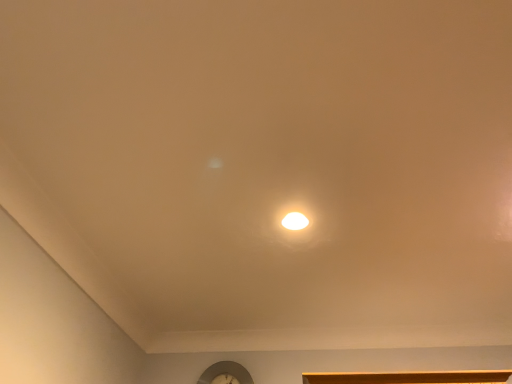
I want to click on metallic silver clock at lower center, so click(x=225, y=374).

What do you see at coordinates (225, 374) in the screenshot?
I see `metallic silver clock at lower center` at bounding box center [225, 374].

Locate an element on the screen. white glossy light fixture at center is located at coordinates tap(295, 221).

This screenshot has height=384, width=512. What do you see at coordinates (295, 221) in the screenshot? I see `white glossy light fixture at center` at bounding box center [295, 221].

The height and width of the screenshot is (384, 512). Find the location of `metallic silver clock at lower center`. metallic silver clock at lower center is located at coordinates (225, 374).

Which is more to the left, metallic silver clock at lower center or white glossy light fixture at center?

metallic silver clock at lower center.

Which object is closer to the camera taking this photo, metallic silver clock at lower center or white glossy light fixture at center?

white glossy light fixture at center is more forward.

Is point (214, 373) closer or farther from the camera than point (295, 215)?

Point (214, 373) appears to be farther away from the viewer than point (295, 215).

From the image's perspective, which is below, metallic silver clock at lower center or white glossy light fixture at center?

metallic silver clock at lower center, from the image's perspective.

From a real-world perspective, which is physically above, metallic silver clock at lower center or white glossy light fixture at center?

white glossy light fixture at center is physically above.

Which of these two, metallic silver clock at lower center or white glossy light fixture at center, is wider?

Wider between the two is white glossy light fixture at center.

Is metallic silver clock at lower center taller or shorter than white glossy light fixture at center?

metallic silver clock at lower center is taller than white glossy light fixture at center.

Can you confirm if metallic silver clock at lower center is smaller than white glossy light fixture at center?

No, metallic silver clock at lower center is not smaller than white glossy light fixture at center.

Consider the image. Would you say white glossy light fixture at center is part of metallic silver clock at lower center's contents?

No, white glossy light fixture at center is not surrounded by metallic silver clock at lower center.

Would you consider metallic silver clock at lower center to be distant from white glossy light fixture at center?

metallic silver clock at lower center is far away from white glossy light fixture at center.

Does metallic silver clock at lower center turn towards white glossy light fixture at center?

Yes.

Image resolution: width=512 pixels, height=384 pixels. Find the location of `clock on the left of white glossy light fixture at center`. clock on the left of white glossy light fixture at center is located at coordinates (225, 374).

Is white glossy light fixture at center to the left or to the right of metallic silver clock at lower center in the image?

white glossy light fixture at center is to the right of metallic silver clock at lower center.

Which object is closer to the camera taking this photo, white glossy light fixture at center or metallic silver clock at lower center?

white glossy light fixture at center is more forward.

Is point (296, 221) farther from viewer compared to point (210, 373)?

That is False.

From the image's perspective, is white glossy light fixture at center above metallic silver clock at lower center?

Indeed, from the image's perspective, white glossy light fixture at center is shown above metallic silver clock at lower center.

From a real-world perspective, is white glossy light fixture at center positioned under metallic silver clock at lower center based on gravity?

Incorrect, from a real-world perspective, white glossy light fixture at center is higher than metallic silver clock at lower center.

Which object is wider, white glossy light fixture at center or metallic silver clock at lower center?

With larger width is white glossy light fixture at center.

Considering the relative sizes of white glossy light fixture at center and metallic silver clock at lower center in the image provided, is white glossy light fixture at center taller than metallic silver clock at lower center?

→ No.

Considering the sizes of white glossy light fixture at center and metallic silver clock at lower center in the image, is white glossy light fixture at center bigger or smaller than metallic silver clock at lower center?

In the image, white glossy light fixture at center appears to be smaller than metallic silver clock at lower center.

Which is correct: white glossy light fixture at center is inside metallic silver clock at lower center, or outside of it?

white glossy light fixture at center cannot be found inside metallic silver clock at lower center.

Is white glossy light fixture at center next to metallic silver clock at lower center?

No.

Is white glossy light fixture at center oriented away from metallic silver clock at lower center?

No, white glossy light fixture at center's orientation is not away from metallic silver clock at lower center.

What's the angular difference between white glossy light fixture at center and metallic silver clock at lower center's facing directions?

90 degrees separate the facing orientations of white glossy light fixture at center and metallic silver clock at lower center.

Identify the location of clock lying on the left of white glossy light fixture at center. coord(225,374).

Locate an element on the screen. This screenshot has height=384, width=512. lamp that appears above the metallic silver clock at lower center (from a real-world perspective) is located at coordinates (295, 221).

Identify the location of lamp on the right of metallic silver clock at lower center. Image resolution: width=512 pixels, height=384 pixels. (295, 221).